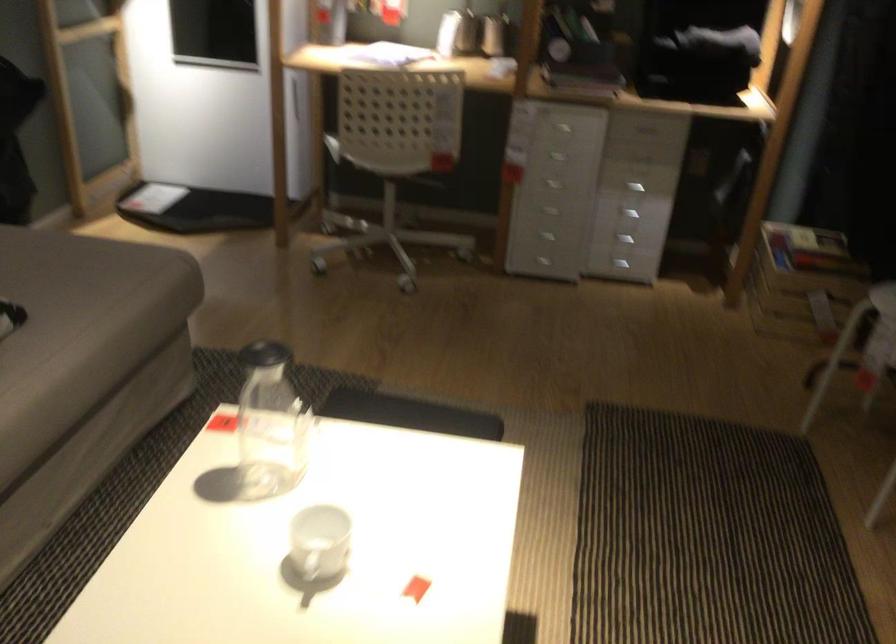
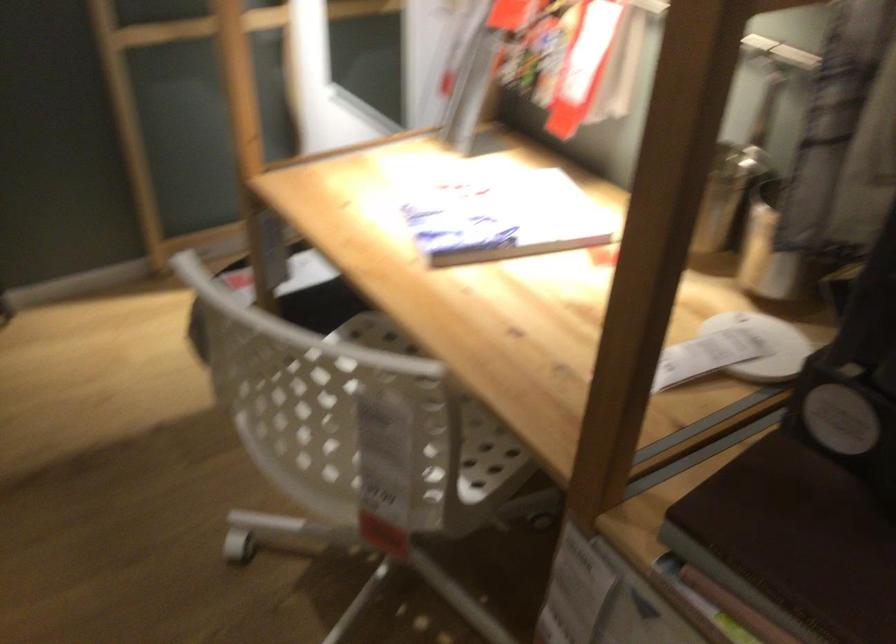
In the second image, find the point that corresponds to point 445,100 in the first image.

(371, 418)